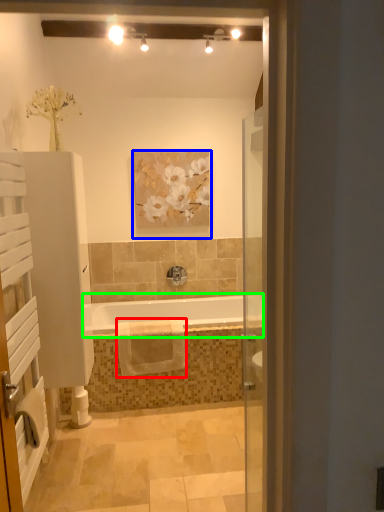
Question: Considering the real-world distances, which object is farthest from bath towel (highlighted by a red box)? picture frame (highlighted by a blue box) or bathtub (highlighted by a green box)?

Choices:
 (A) picture frame
 (B) bathtub

Answer: (A)